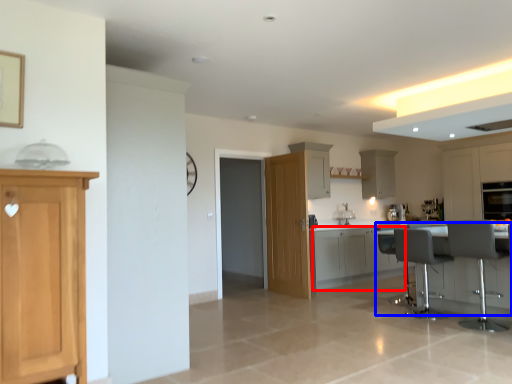
Question: Which object is further to the camera taking this photo, cabinetry (highlighted by a red box) or table (highlighted by a blue box)?

Choices:
 (A) cabinetry
 (B) table

Answer: (A)